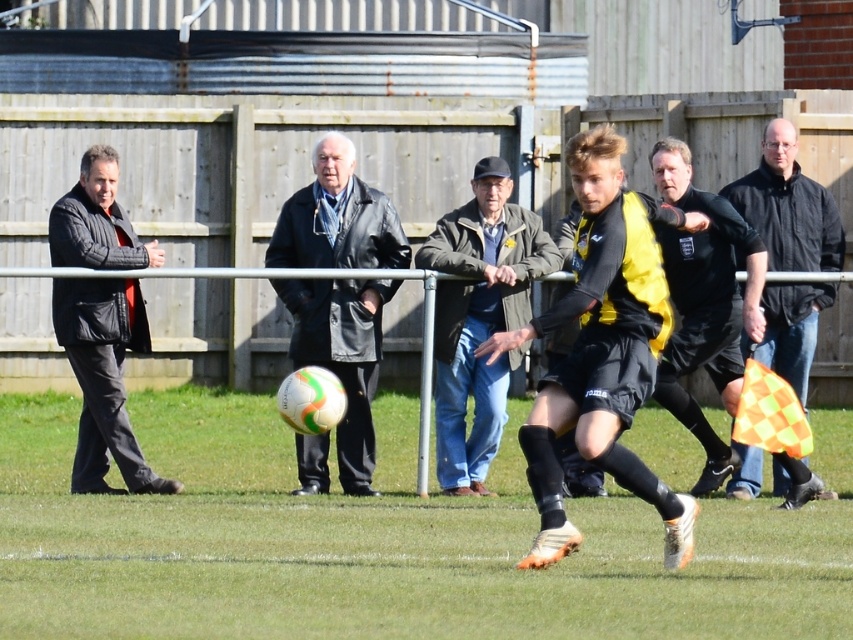
Consider the image. You are a photographer standing at the camera position. You want to capture a closeup shot of the black quilted jacket at left. Given that your camera has a maximum zoom range of 15 meters, can you achieve this without moving closer?

The black quilted jacket at left is 15.67 meters away from the camera. Since the camera can only zoom up to 15 meters, it cannot reach the required distance. Therefore, you cannot capture a closeup without moving closer.

You are a photographer standing at the camera position. You want to capture a closeup of the leather jacket at center. Is it possible to do so without moving the camera?

The leather jacket at center is 15.97 meters away from the camera. Since it is relatively far away, you would need a zoom lens to capture a closeup without moving the camera position.

You are a spectator trying to pass through a narrow hallway between the black quilted jacket at left and the black leather jacket at right. Can you fit through the space between them?

The black quilted jacket at left has a lesser width compared to the black leather jacket at right, so the space between them may be narrower on the left side. However, without knowing the total distance between the jackets or the hallway width, it is uncertain if you can fit through.